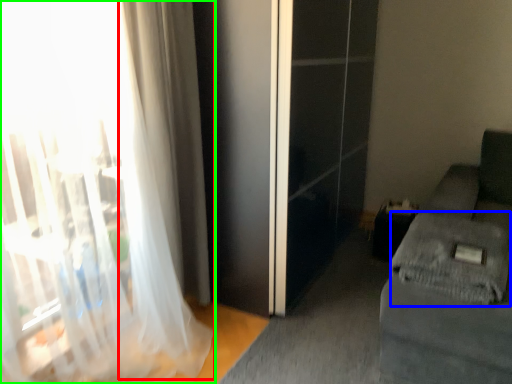
Question: Estimate the real-world distances between objects in this image. Which object is farther from curtain (highlighted by a red box), sheet (highlighted by a blue box) or curtain (highlighted by a green box)?

Choices:
 (A) sheet
 (B) curtain

Answer: (A)